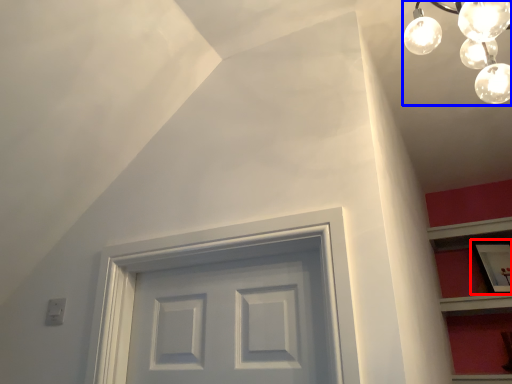
Question: Which of the following is the farthest to the observer, picture frame (highlighted by a red box) or light fixture (highlighted by a blue box)?

Choices:
 (A) picture frame
 (B) light fixture

Answer: (A)